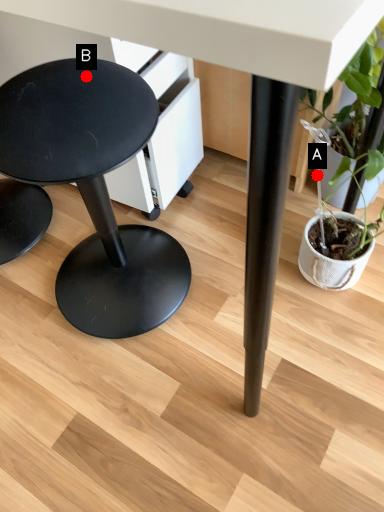
Question: Two points are circled on the image, labeled by A and B beside each circle. Which point is farther from the camera taking this photo?

Choices:
 (A) A is further
 (B) B is further

Answer: (A)